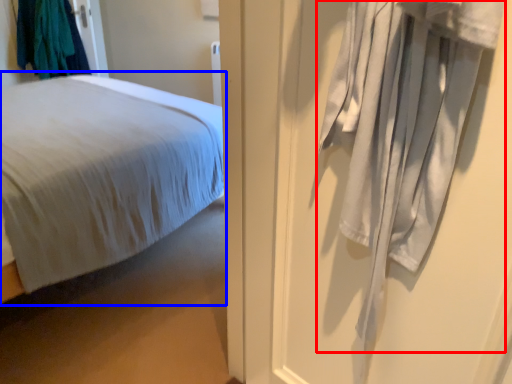
Question: Which of the following is the closest to the observer, curtain (highlighted by a red box) or bed (highlighted by a blue box)?

Choices:
 (A) curtain
 (B) bed

Answer: (A)